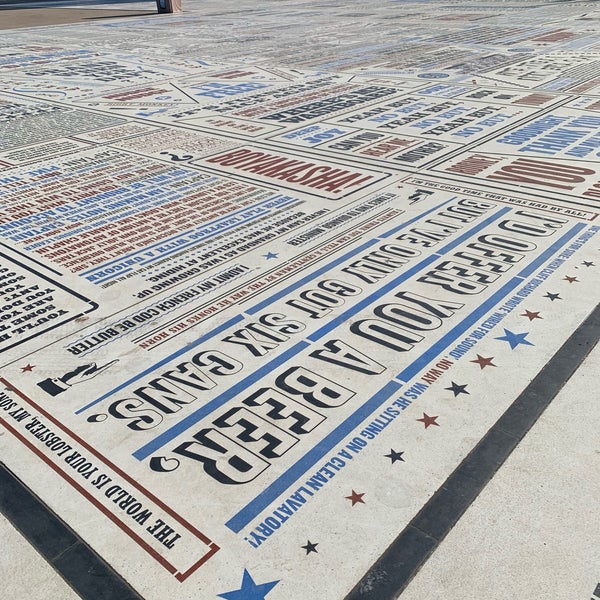
Where is `walls`? Image resolution: width=600 pixels, height=600 pixels. walls is located at coordinates (139, 592).